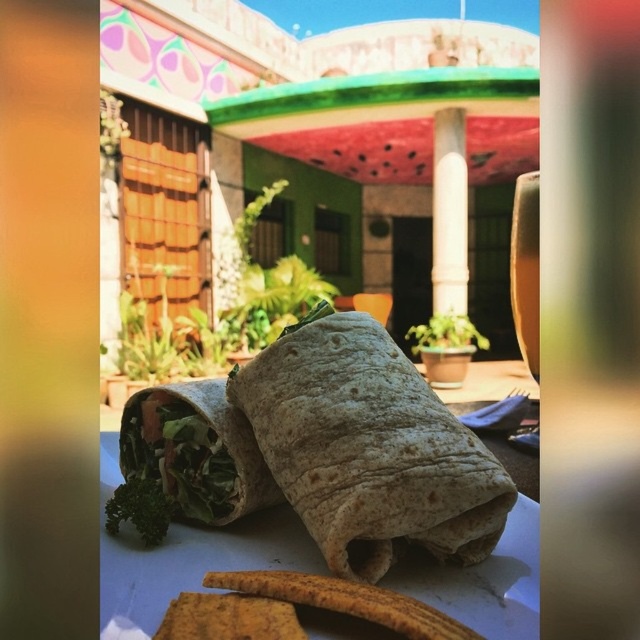
Does brown tortilla burrito at center appear over white smooth pillar at center?

No, brown tortilla burrito at center is not above white smooth pillar at center.

Does brown tortilla burrito at center have a smaller size compared to white smooth pillar at center?

Actually, brown tortilla burrito at center might be larger than white smooth pillar at center.

Locate an element on the screen. The image size is (640, 640). brown tortilla burrito at center is located at coordinates (369, 445).

Is brown tortilla burrito at center below white paper plate at center?

Actually, brown tortilla burrito at center is above white paper plate at center.

Is brown tortilla burrito at center smaller than white paper plate at center?

Correct, brown tortilla burrito at center occupies less space than white paper plate at center.

Which is in front, point (481, 458) or point (449, 404)?

Point (481, 458)

Image resolution: width=640 pixels, height=640 pixels. In order to click on brown tortilla burrito at center in this screenshot , I will do `click(369, 445)`.

Can you confirm if brown tortilla burrito at center is taller than green leafy burrito at center?

Correct, brown tortilla burrito at center is much taller as green leafy burrito at center.

Between brown tortilla burrito at center and green leafy burrito at center, which one appears on the right side from the viewer's perspective?

brown tortilla burrito at center is more to the right.

Is point (369, 428) farther from camera compared to point (202, 484)?

No, (369, 428) is in front of (202, 484).

At what (x,y) coordinates should I click in order to perform the action: click on brown tortilla burrito at center. Please return your answer as a coordinate pair (x, y). Looking at the image, I should click on (369, 445).